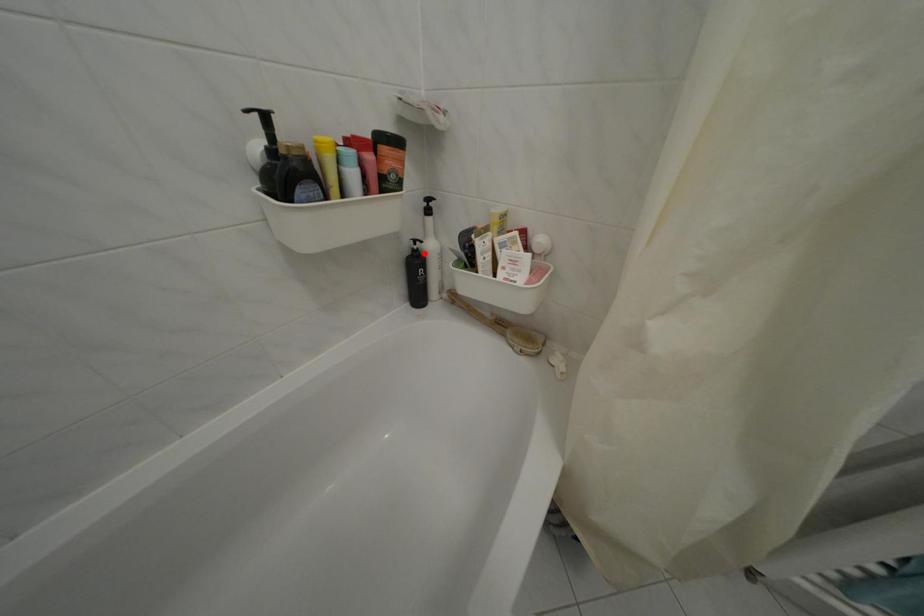
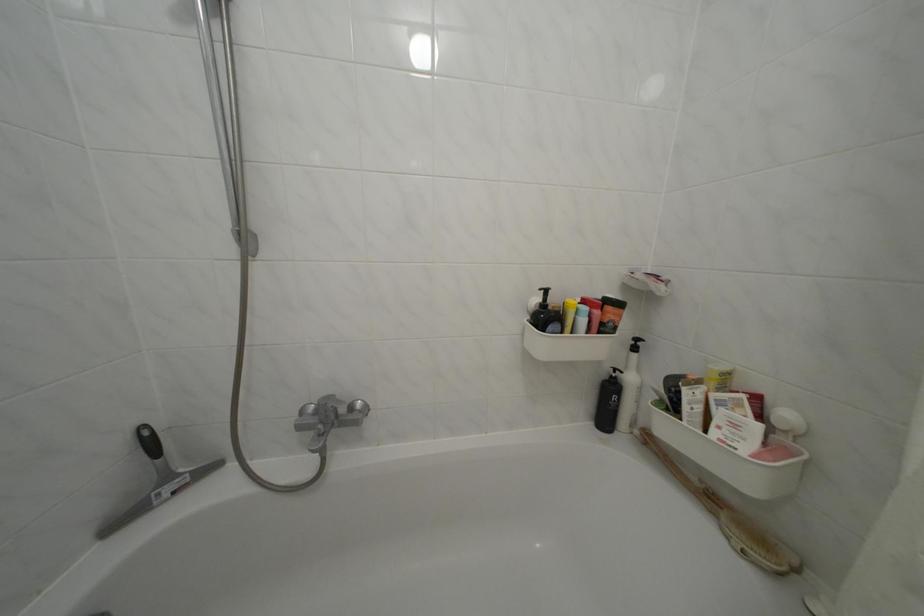
Question: I am providing you with two images of the same scene from different viewpoints. A red point is shown in image1. For the corresponding object point in image2, is it positioned nearer or farther from the camera?

Choices:
 (A) Nearer
 (B) Farther

Answer: (B)